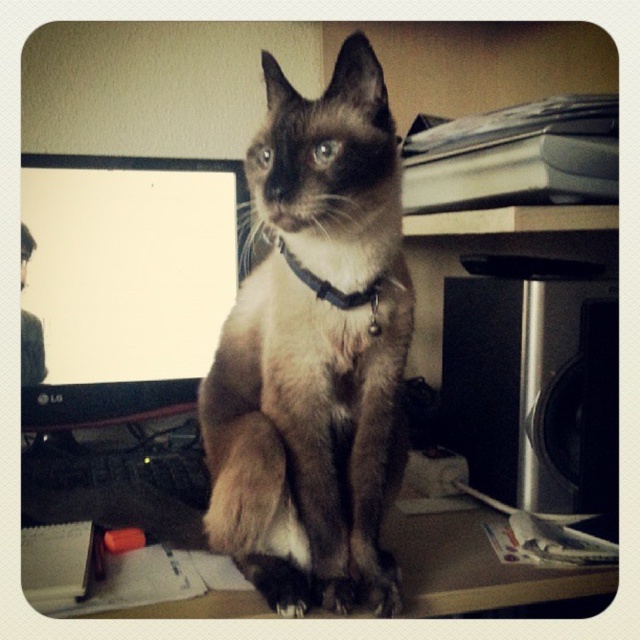
You are a delivery person who just arrived at an office. You see the matte black monitor at left and the black leather collar at center. Which object is taller?

The matte black monitor at left is taller than the black leather collar at center.

You are a cat owner who wants to place a small bowl of water for your Siamese cat. The bowl is 10 cm in diameter. The cat is wearing a black leather collar at center and sitting on a brown wooden table at lower center. Considering the collar and table positions, where should you place the bowl to ensure it is within reach of the cat but not under the collar?

The brown wooden table at lower center is positioned under the black leather collar at center. To place the bowl within reach but not under the collar, position it on the table away from the area directly under the collar.

You are standing in front of the desk where the Siamese cat is sitting. You notice two points marked on the desk. The first point is at coordinates point (486,595) and the second point is at point (337,298). From your perspective, which point is closer to you?

Point (337,298) is closer to you because it is in front of point (486,595) according to their spatial arrangement.